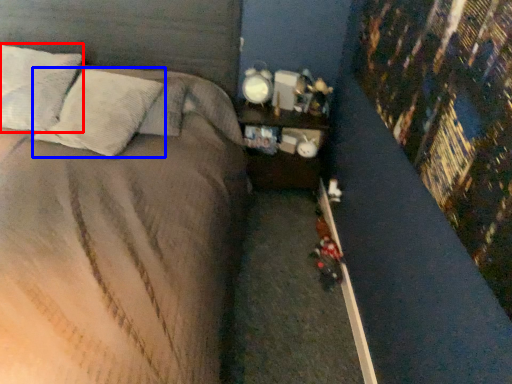
Question: Which object is further to the camera taking this photo, pillow (highlighted by a red box) or pillow (highlighted by a blue box)?

Choices:
 (A) pillow
 (B) pillow

Answer: (A)